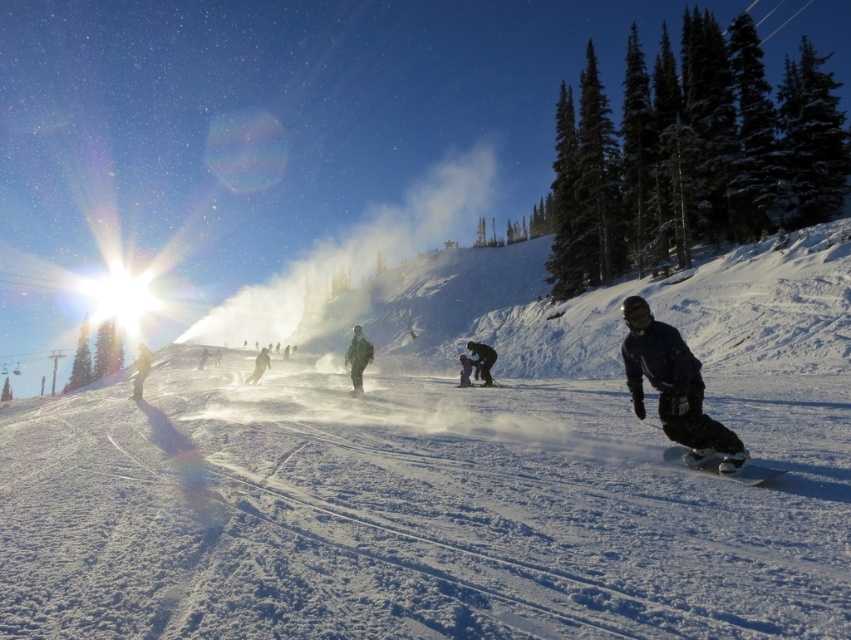
Question: Can you confirm if green fabric jacket at center is positioned to the right of dark blue snowboarder at center?

Choices:
 (A) yes
 (B) no

Answer: (B)

Question: Which point appears closest to the camera in this image?

Choices:
 (A) (263, 349)
 (B) (495, 552)
 (C) (461, 360)

Answer: (B)

Question: Among these points, which one is farthest from the camera?

Choices:
 (A) (477, 356)
 (B) (255, 378)

Answer: (B)

Question: Which point appears farthest from the camera in this image?

Choices:
 (A) (480, 346)
 (B) (475, 369)
 (C) (266, 358)

Answer: (C)

Question: Can you confirm if shiny black snowboard at lower right is positioned above dark blue snowboarder at center?

Choices:
 (A) yes
 (B) no

Answer: (B)

Question: Can you confirm if shiny black snowboard at lower right is positioned to the right of green snowsuit at center?

Choices:
 (A) no
 (B) yes

Answer: (B)